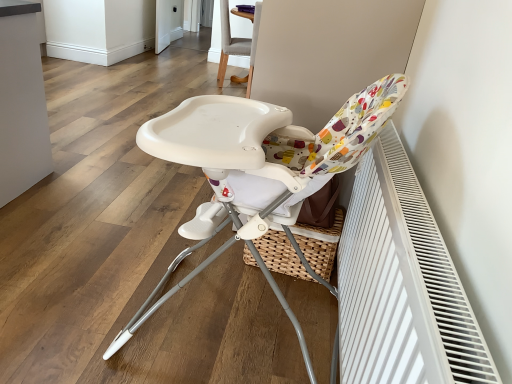
Question: Which direction should I rotate to look at white plastic highchair at center, the first chair from the front, — up or down?

Choices:
 (A) up
 (B) down

Answer: (B)

Question: Which direction should I rotate to look at light gray fabric chair at upper center, the 2th chair in the front-to-back sequence, — up or down?

Choices:
 (A) up
 (B) down

Answer: (A)

Question: Considering the relative sizes of white textured radiator at right and white plastic highchair at center, which is counted as the second chair, starting from the back, in the image provided, is white textured radiator at right taller than white plastic highchair at center, which is counted as the second chair, starting from the back,?

Choices:
 (A) yes
 (B) no

Answer: (B)

Question: Is white textured radiator at right positioned beyond the bounds of white plastic highchair at center, marked as the 1th chair in a bottom-to-top arrangement?

Choices:
 (A) yes
 (B) no

Answer: (A)

Question: Can you confirm if white textured radiator at right is positioned to the right of white plastic highchair at center, the first chair from the front?

Choices:
 (A) yes
 (B) no

Answer: (A)

Question: Is white plastic highchair at center, the first chair from the front, at the back of white textured radiator at right?

Choices:
 (A) no
 (B) yes

Answer: (B)

Question: Does white textured radiator at right have a lesser height compared to white plastic highchair at center, marked as the 1th chair in a bottom-to-top arrangement?

Choices:
 (A) no
 (B) yes

Answer: (B)

Question: Is white textured radiator at right bigger than white plastic highchair at center, marked as the 1th chair in a bottom-to-top arrangement?

Choices:
 (A) no
 (B) yes

Answer: (A)

Question: Is white textured radiator at right located within white plastic highchair at center, marked as the 1th chair in a bottom-to-top arrangement?

Choices:
 (A) no
 (B) yes

Answer: (A)

Question: From the image's perspective, is white plastic highchair at center, the first chair from the front, below white textured radiator at right?

Choices:
 (A) no
 (B) yes

Answer: (A)

Question: Is white plastic highchair at center, which is counted as the second chair, starting from the back, aimed at white textured radiator at right?

Choices:
 (A) yes
 (B) no

Answer: (B)

Question: Can you confirm if white plastic highchair at center, which is counted as the second chair, starting from the back, is wider than white textured radiator at right?

Choices:
 (A) yes
 (B) no

Answer: (A)

Question: Can you confirm if white plastic highchair at center, arranged as the 2th chair when viewed from the top, is positioned to the left of white textured radiator at right?

Choices:
 (A) no
 (B) yes

Answer: (B)

Question: From a real-world perspective, is white plastic highchair at center, the first chair from the front, beneath white textured radiator at right?

Choices:
 (A) yes
 (B) no

Answer: (B)

Question: Can you confirm if white textured radiator at right is shorter than light gray fabric chair at upper center, the first chair viewed from the top?

Choices:
 (A) yes
 (B) no

Answer: (A)